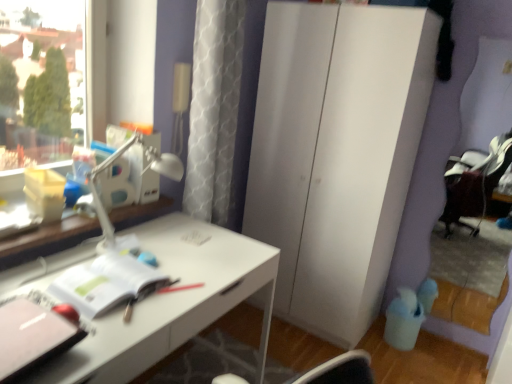
Find the location of a particular element. free location to the right of pink matte notebook at lower left, marked as the 2th notebook in a back-to-front arrangement is located at coordinates (118, 337).